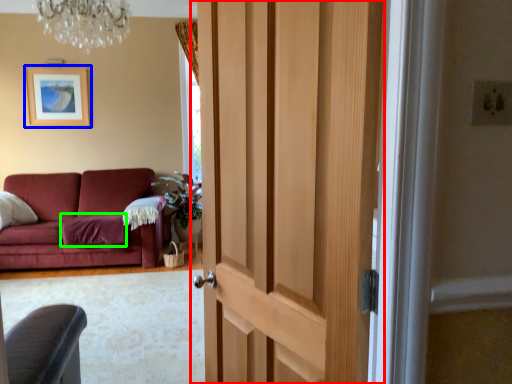
Question: Which is farther away from door (highlighted by a red box)? picture frame (highlighted by a blue box) or blanket (highlighted by a green box)?

Choices:
 (A) picture frame
 (B) blanket

Answer: (A)